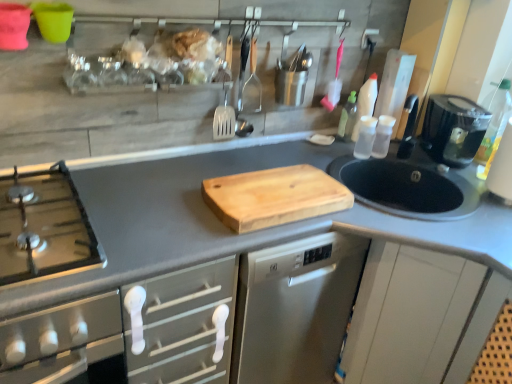
The image size is (512, 384). I want to click on free region under black plastic coffee maker at right (from a real-world perspective), so click(442, 161).